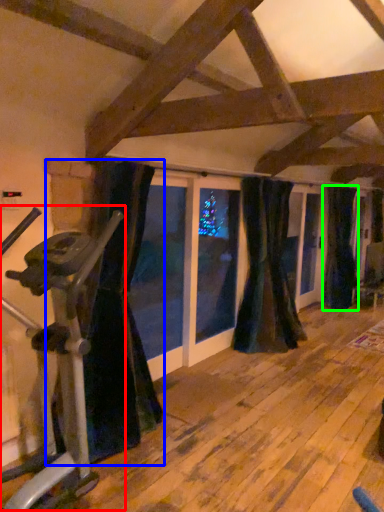
Question: Estimate the real-world distances between objects in this image. Which object is farther from stationary bicycle (highlighted by a red box), curtain (highlighted by a blue box) or curtain (highlighted by a green box)?

Choices:
 (A) curtain
 (B) curtain

Answer: (B)